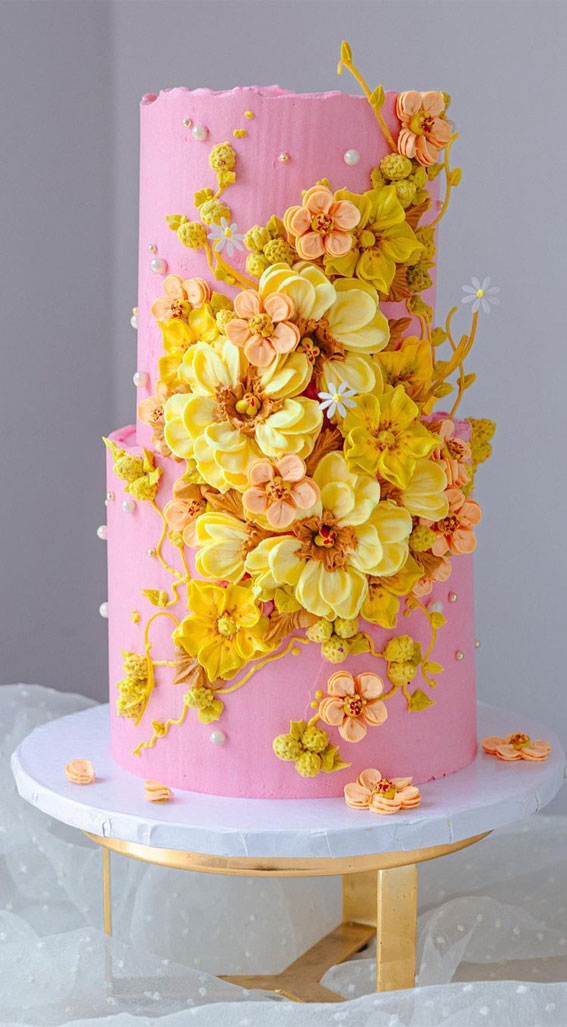
Where is `legs of cake stand`? The height and width of the screenshot is (1027, 567). legs of cake stand is located at coordinates (395, 930), (365, 905), (108, 907).